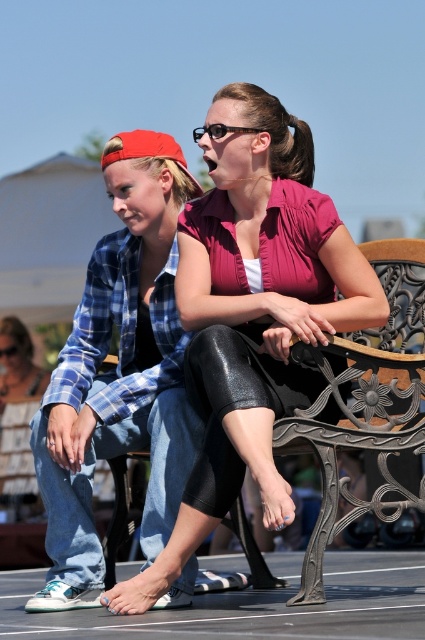
You are a photographer trying to capture a clear shot of both the matte black leggings at center and the matte blue plaid shirt at center. Since you want to focus on both, which one should you adjust your camera focus on first to ensure both are in focus?

The matte black leggings at center is in front of the matte blue plaid shirt at center. To ensure both are in focus, you should focus on the matte blue plaid shirt at center first, as it is farther back, and the depth of field will naturally include the closer object.

You are a photographer setting up a camera to capture a closeup of both the matte black leggings at center and the matte blue plaid shirt at center. The camera lens has a maximum focus range of 2 meters. Will you be able to focus on both subjects simultaneously?

The matte black leggings at center and matte blue plaid shirt at center are 2.09 meters apart from each other, which exceeds the camera lens maximum focus range of 2 meters. Therefore, the camera cannot focus on both subjects simultaneously.